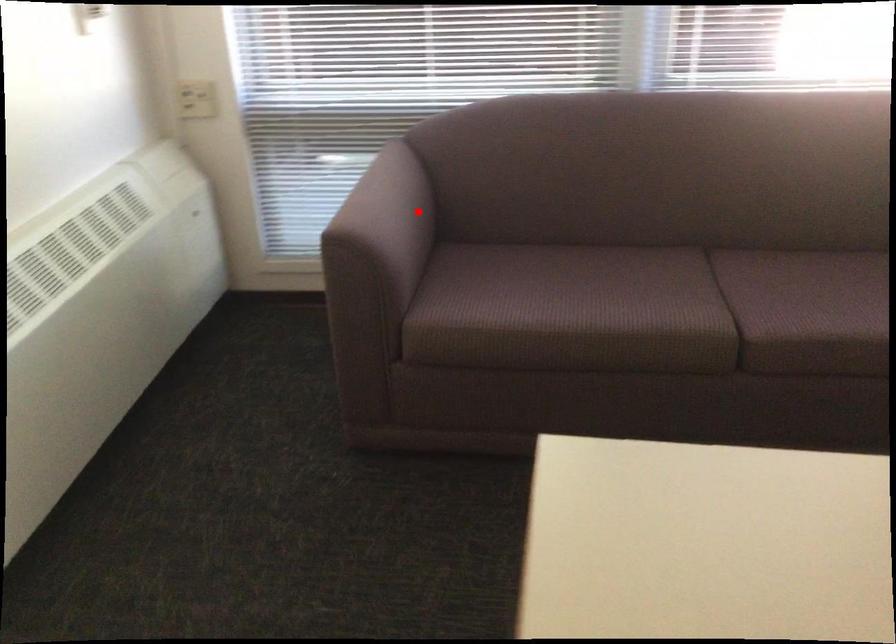
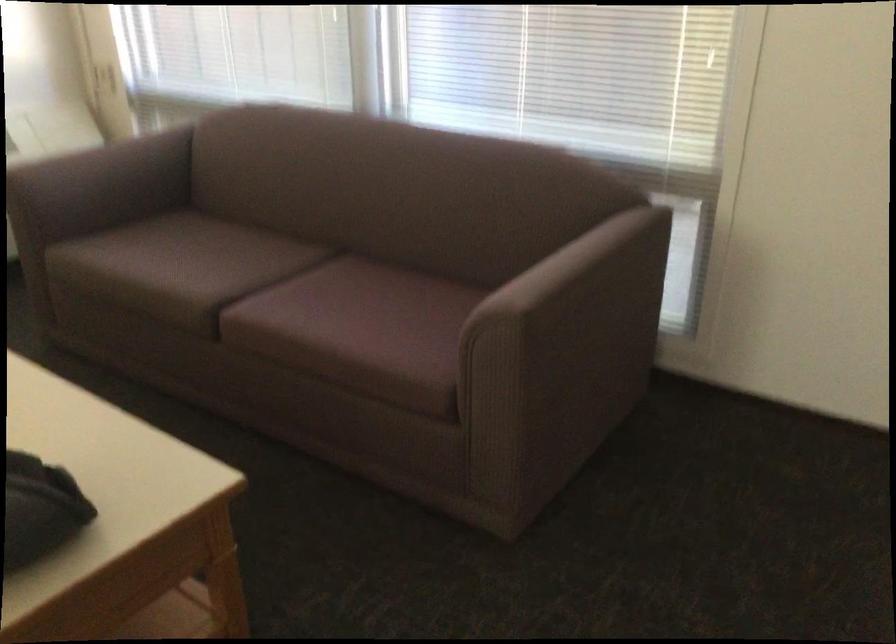
Question: I am providing you with two images of the same scene from different viewpoints. A red point is marked on the first image. At the location where the point appears in image 1, is it still visible in image 2?

Choices:
 (A) Yes
 (B) No

Answer: (A)